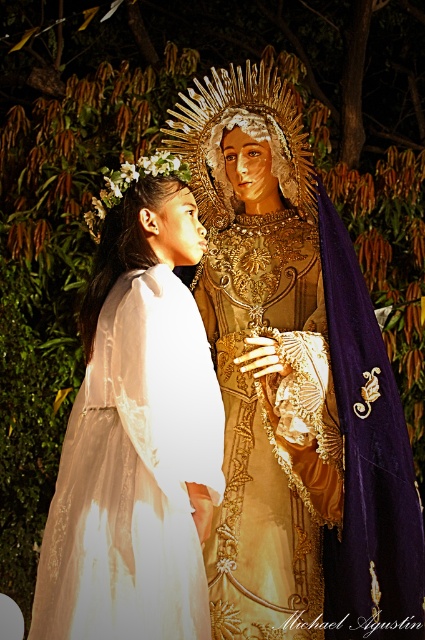
Question: Among these objects, which one is farthest from the camera?

Choices:
 (A) white lace dress at left
 (B) gold textured crown at center

Answer: (B)

Question: Which object is farther from the camera taking this photo?

Choices:
 (A) gold satin dress at center
 (B) gold textured crown at center
 (C) white lace dress at left

Answer: (B)

Question: Which of these objects is positioned farthest from the white lace dress at left?

Choices:
 (A) gold satin dress at center
 (B) gold textured crown at center

Answer: (B)

Question: Does white lace dress at left come behind gold satin dress at center?

Choices:
 (A) yes
 (B) no

Answer: (B)

Question: Does gold satin dress at center have a lesser width compared to gold textured crown at center?

Choices:
 (A) yes
 (B) no

Answer: (A)

Question: Does white lace dress at left appear on the left side of gold textured crown at center?

Choices:
 (A) no
 (B) yes

Answer: (B)